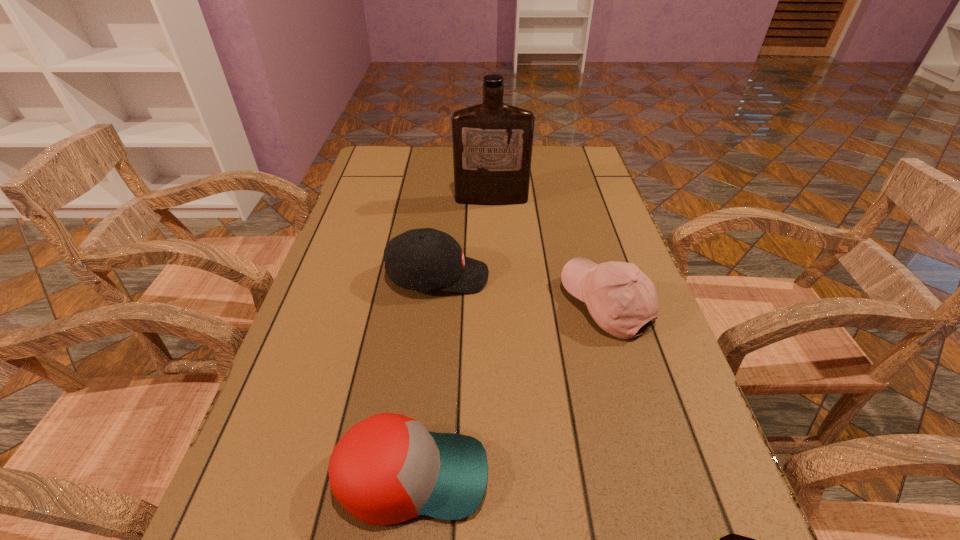
This screenshot has width=960, height=540. In order to click on object located in the right edge section of the desktop in this screenshot , I will do `click(621, 299)`.

The width and height of the screenshot is (960, 540). I want to click on free spot at the left edge of the desktop, so click(372, 240).

Where is `vacant space at the right edge`? The height and width of the screenshot is (540, 960). vacant space at the right edge is located at coordinates (624, 410).

At what (x,y) coordinates should I click in order to perform the action: click on vacant space at the far left corner of the desktop. Please return your answer as a coordinate pair (x, y). Looking at the image, I should click on (402, 170).

Identify the location of free space between the nearest baseball cap and the rightmost baseball cap. (509, 390).

Locate an element on the screen. Image resolution: width=960 pixels, height=540 pixels. vacant area that lies between the tallest object and the rightmost baseball cap is located at coordinates (548, 252).

Find the location of a particular element. Image resolution: width=960 pixels, height=540 pixels. empty space that is in between the rightmost baseball cap and the tallest object is located at coordinates (548, 252).

Identify the location of free space between the second shortest object and the rightmost baseball cap. The height and width of the screenshot is (540, 960). (509, 390).

Locate an element on the screen. This screenshot has width=960, height=540. unoccupied position between the farthest object and the shortest baseball cap is located at coordinates (452, 338).

This screenshot has height=540, width=960. Find the location of `object that is the fourth nearest to the shortest baseball cap`. object that is the fourth nearest to the shortest baseball cap is located at coordinates (492, 142).